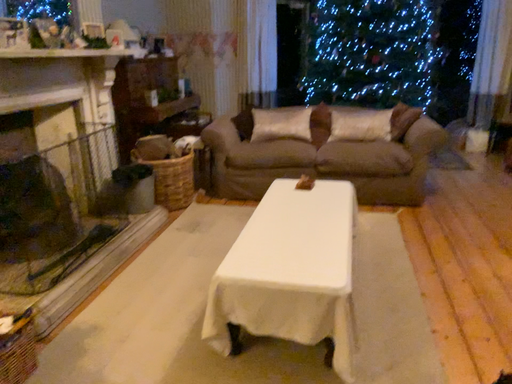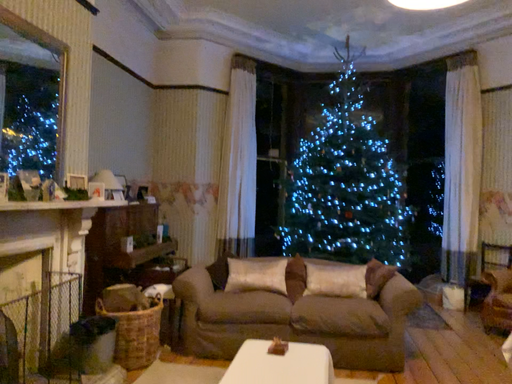
Question: How did the camera likely rotate when shooting the video?

Choices:
 (A) rotated downward
 (B) rotated upward

Answer: (B)